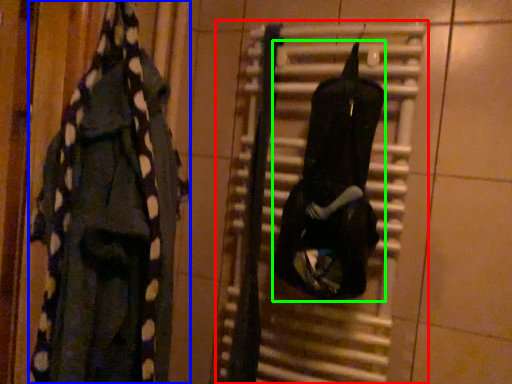
Question: Based on their relative distances, which object is farther from radiator (highlighted by a red box)? Choose from clothing (highlighted by a blue box) and clothing (highlighted by a green box).

Choices:
 (A) clothing
 (B) clothing

Answer: (A)